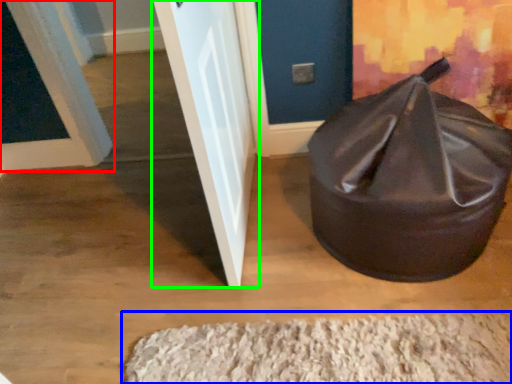
Question: Which object is positioned closest to door (highlighted by a red box)? Select from doormat (highlighted by a blue box) and door (highlighted by a green box).

Choices:
 (A) doormat
 (B) door

Answer: (B)